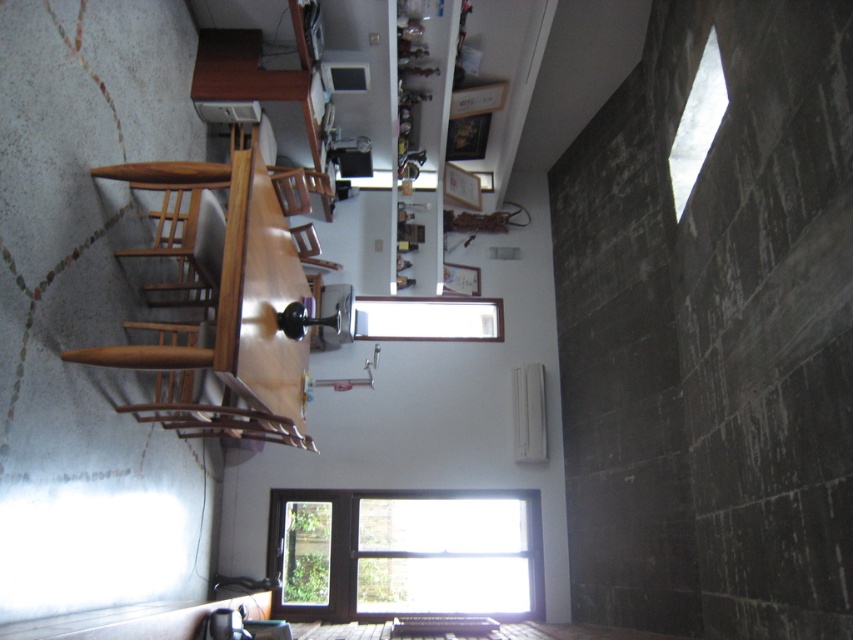
Between transparent glass window at center and wooden chair at center, which one is positioned lower?

transparent glass window at center is below.

Locate an element on the screen. transparent glass window at center is located at coordinates (404, 554).

Does point (381, 529) come in front of point (315, 234)?

That is True.

This screenshot has width=853, height=640. What are the coordinates of `transparent glass window at center` in the screenshot? It's located at (404, 554).

Can you confirm if transparent glass window at center is positioned to the right of clear glass window at upper center?

In fact, transparent glass window at center is to the left of clear glass window at upper center.

Which is behind, point (509, 572) or point (709, 67)?

Point (509, 572)

This screenshot has width=853, height=640. What are the coordinates of `transparent glass window at center` in the screenshot? It's located at (404, 554).

Can you confirm if clear glass window at upper center is positioned to the left of wooden chair at center?

In fact, clear glass window at upper center is to the right of wooden chair at center.

Is clear glass window at upper center positioned in front of wooden chair at center?

That is True.

At what (x,y) coordinates should I click in order to perform the action: click on clear glass window at upper center. Please return your answer as a coordinate pair (x, y). Looking at the image, I should click on (697, 124).